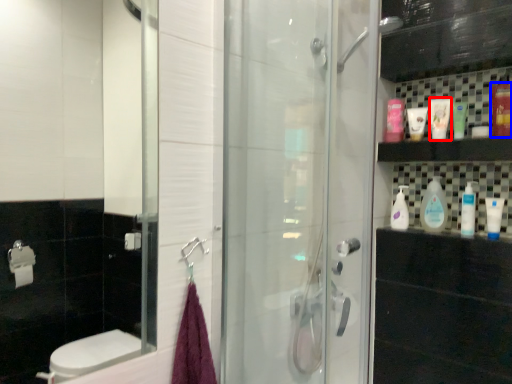
Question: Which point is further to the camera, mouthwash (highlighted by a red box) or mouthwash (highlighted by a blue box)?

Choices:
 (A) mouthwash
 (B) mouthwash

Answer: (A)